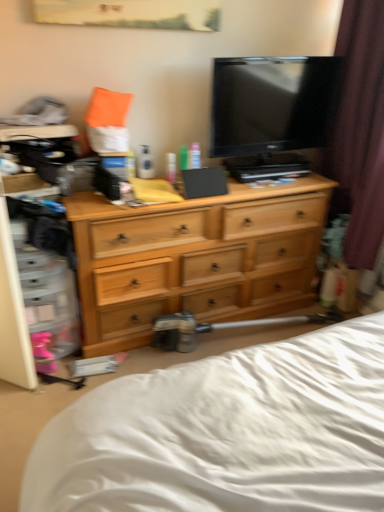
What is the approximate height of brown velvet curtain at right?

brown velvet curtain at right is 4.45 feet tall.

What do you see at coordinates (183, 157) in the screenshot? I see `green plastic bottle at center, the first toiletry positioned from the left` at bounding box center [183, 157].

At what (x,y) coordinates should I click in order to perform the action: click on light wood dresser at center. Please return your answer as a coordinate pair (x, y). The width and height of the screenshot is (384, 512). Looking at the image, I should click on (195, 258).

In order to click on black glossy tv at upper center in this screenshot , I will do `click(272, 104)`.

Is brown velvet curtain at right at the back of green plastic bottle at center, the 2th toiletry from the right?

green plastic bottle at center, the 2th toiletry from the right, is not turned away from brown velvet curtain at right.

Does green plastic bottle at center, the first toiletry positioned from the left, have a lesser height compared to brown velvet curtain at right?

Yes.

Does green plastic bottle at center, the first toiletry positioned from the left, touch brown velvet curtain at right?

No, green plastic bottle at center, the first toiletry positioned from the left, is not in contact with brown velvet curtain at right.

Is green plastic bottle at center, the 2th toiletry from the right, to the left of brown velvet curtain at right from the viewer's perspective?

Yes, green plastic bottle at center, the 2th toiletry from the right, is to the left of brown velvet curtain at right.

Is brown velvet curtain at right to the left of light wood dresser at center from the viewer's perspective?

No, brown velvet curtain at right is not to the left of light wood dresser at center.

Considering the positions of points (379, 140) and (258, 201), is point (379, 140) farther from camera compared to point (258, 201)?

No, (379, 140) is closer to viewer.

Is brown velvet curtain at right far from light wood dresser at center?

No, brown velvet curtain at right is in close proximity to light wood dresser at center.

In the scene shown: In the image, is brown velvet curtain at right positioned in front of or behind light wood dresser at center?

In the image, brown velvet curtain at right appears in front of light wood dresser at center.

Considering the relative sizes of green plastic bottle at center, the first toiletry positioned from the left, and white soft bed at lower center in the image provided, is green plastic bottle at center, the first toiletry positioned from the left, bigger than white soft bed at lower center?

Actually, green plastic bottle at center, the first toiletry positioned from the left, might be smaller than white soft bed at lower center.

Does point (184, 151) come farther from viewer compared to point (179, 465)?

Yes, point (184, 151) is farther from viewer.

Is green plastic bottle at center, the 2th toiletry from the right, positioned before white soft bed at lower center?

No.

Is light wood dresser at center shorter than translucent plastic tube at center, the second toiletry viewed from the left?

No, light wood dresser at center is not shorter than translucent plastic tube at center, the second toiletry viewed from the left.

Is light wood dresser at center not near translucent plastic tube at center, placed as the first toiletry when sorted from right to left?

That's not correct — light wood dresser at center is a little close to translucent plastic tube at center, placed as the first toiletry when sorted from right to left.

The width and height of the screenshot is (384, 512). What are the coordinates of `the chest of drawers in front of the translucent plastic tube at center, the second toiletry viewed from the left` in the screenshot? It's located at (195, 258).

Considering the sizes of translucent plastic tube at center, the second toiletry viewed from the left, and black glossy tv at upper center in the image, is translucent plastic tube at center, the second toiletry viewed from the left, wider or thinner than black glossy tv at upper center?

Clearly, translucent plastic tube at center, the second toiletry viewed from the left, has less width compared to black glossy tv at upper center.

Which is more to the right, translucent plastic tube at center, placed as the first toiletry when sorted from right to left, or black glossy tv at upper center?

From the viewer's perspective, black glossy tv at upper center appears more on the right side.

Is point (195, 145) positioned in front of point (288, 80)?

No, (195, 145) is further to viewer.

Which toiletry is the 2nd one when counting from the back of the black glossy tv at upper center? Please provide its 2D coordinates.

[(194, 156)]

Is brown velvet curtain at right bigger than white soft bed at lower center?

Actually, brown velvet curtain at right might be smaller than white soft bed at lower center.

Choose the correct answer: Is brown velvet curtain at right inside white soft bed at lower center or outside it?

brown velvet curtain at right is spatially situated outside white soft bed at lower center.

Is brown velvet curtain at right aimed at white soft bed at lower center?

No, brown velvet curtain at right is not facing towards white soft bed at lower center.

Between black glossy tv at upper center and green plastic bottle at center, the 2th toiletry from the right, which one has larger width?

With larger width is black glossy tv at upper center.

How distant is black glossy tv at upper center from green plastic bottle at center, the 2th toiletry from the right?

black glossy tv at upper center and green plastic bottle at center, the 2th toiletry from the right, are 20.98 inches apart from each other.

From a real-world perspective, relative to green plastic bottle at center, the first toiletry positioned from the left, is black glossy tv at upper center vertically above or below?

In terms of real-world spatial position, black glossy tv at upper center is above green plastic bottle at center, the first toiletry positioned from the left.

Do you think black glossy tv at upper center is within green plastic bottle at center, the first toiletry positioned from the left, or outside of it?

black glossy tv at upper center exists outside the volume of green plastic bottle at center, the first toiletry positioned from the left.

Find the location of a particular element. Image resolution: width=384 pixels, height=512 pixels. curtain that is above the green plastic bottle at center, the first toiletry positioned from the left (from a real-world perspective) is located at coordinates (359, 131).

This screenshot has height=512, width=384. I want to click on the chest of drawers below the brown velvet curtain at right (from a real-world perspective), so click(x=195, y=258).

Estimate the real-world distances between objects in this image. Which object is further from light wood dresser at center, black glossy tv at upper center or white soft bed at lower center?

white soft bed at lower center is positioned further to the anchor light wood dresser at center.

When comparing their distances from brown velvet curtain at right, does translucent plastic tube at center, the second toiletry viewed from the left, or green plastic bottle at center, the first toiletry positioned from the left, seem further?

green plastic bottle at center, the first toiletry positioned from the left, is further to brown velvet curtain at right.

From the picture: From the image, which object appears to be nearer to translucent plastic tube at center, placed as the first toiletry when sorted from right to left, white soft bed at lower center or brown velvet curtain at right?

brown velvet curtain at right lies closer to translucent plastic tube at center, placed as the first toiletry when sorted from right to left, than the other object.

Considering their positions, is black glossy tv at upper center positioned further to brown velvet curtain at right than light wood dresser at center?

light wood dresser at center is further to brown velvet curtain at right.

Estimate the real-world distances between objects in this image. Which object is closer to brown velvet curtain at right, green plastic bottle at center, the 2th toiletry from the right, or translucent plastic tube at center, the second toiletry viewed from the left?

translucent plastic tube at center, the second toiletry viewed from the left.

Looking at the image, which one is located further to translucent plastic tube at center, placed as the first toiletry when sorted from right to left, light wood dresser at center or brown velvet curtain at right?

The object further to translucent plastic tube at center, placed as the first toiletry when sorted from right to left, is brown velvet curtain at right.

Based on the photo, when comparing their distances from translucent plastic tube at center, placed as the first toiletry when sorted from right to left, does light wood dresser at center or white soft bed at lower center seem closer?

Among the two, light wood dresser at center is located nearer to translucent plastic tube at center, placed as the first toiletry when sorted from right to left.

When comparing their distances from light wood dresser at center, does brown velvet curtain at right or green plastic bottle at center, the 2th toiletry from the right, seem further?

The object further to light wood dresser at center is brown velvet curtain at right.

Locate an element on the screen. The height and width of the screenshot is (512, 384). chest of drawers between white soft bed at lower center and green plastic bottle at center, the 2th toiletry from the right, in the front-back direction is located at coordinates pyautogui.click(x=195, y=258).

Locate an element on the screen. television between white soft bed at lower center and translucent plastic tube at center, the second toiletry viewed from the left, along the z-axis is located at coordinates (272, 104).

Locate an element on the screen. This screenshot has width=384, height=512. toiletry between green plastic bottle at center, the 2th toiletry from the right, and brown velvet curtain at right from left to right is located at coordinates (194, 156).

Image resolution: width=384 pixels, height=512 pixels. Identify the location of the chest of drawers located between white soft bed at lower center and black glossy tv at upper center in the depth direction. (195, 258).